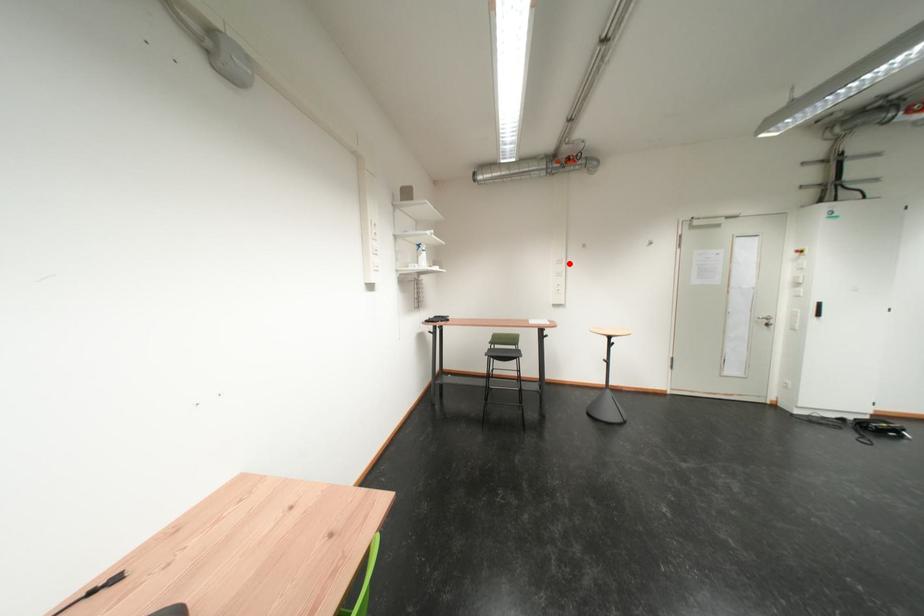
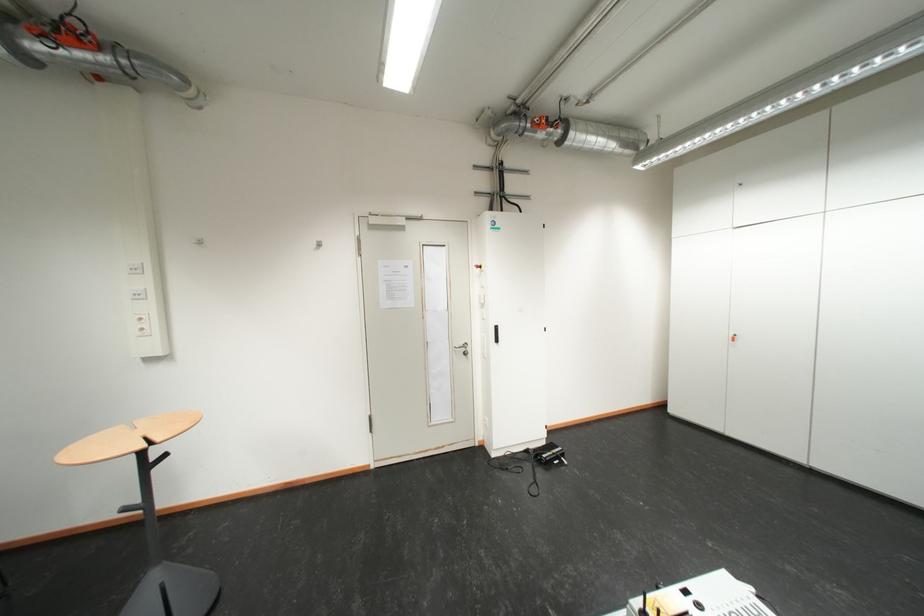
Question: I am providing you with two images of the same scene from different viewpoints. In image1, a red point is highlighted. Considering the same 3D point in image2, which of the following is correct?

Choices:
 (A) It is closer
 (B) It is farther

Answer: (B)